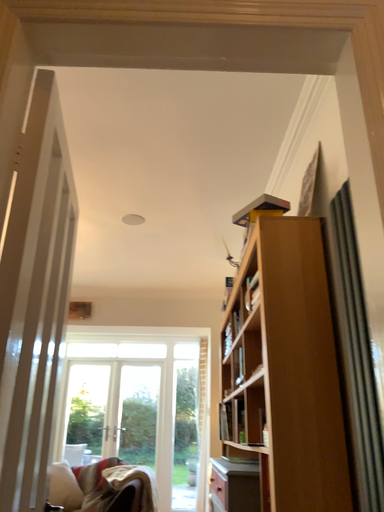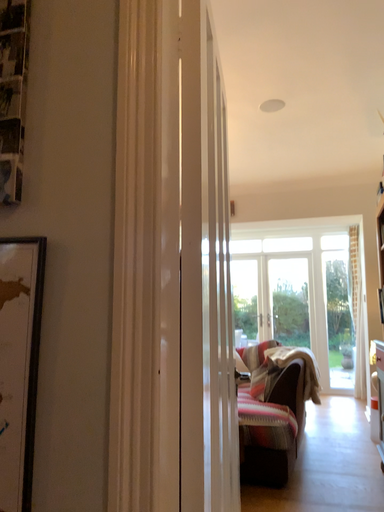
Question: How did the camera likely rotate when shooting the video?

Choices:
 (A) rotated upward
 (B) rotated downward

Answer: (B)